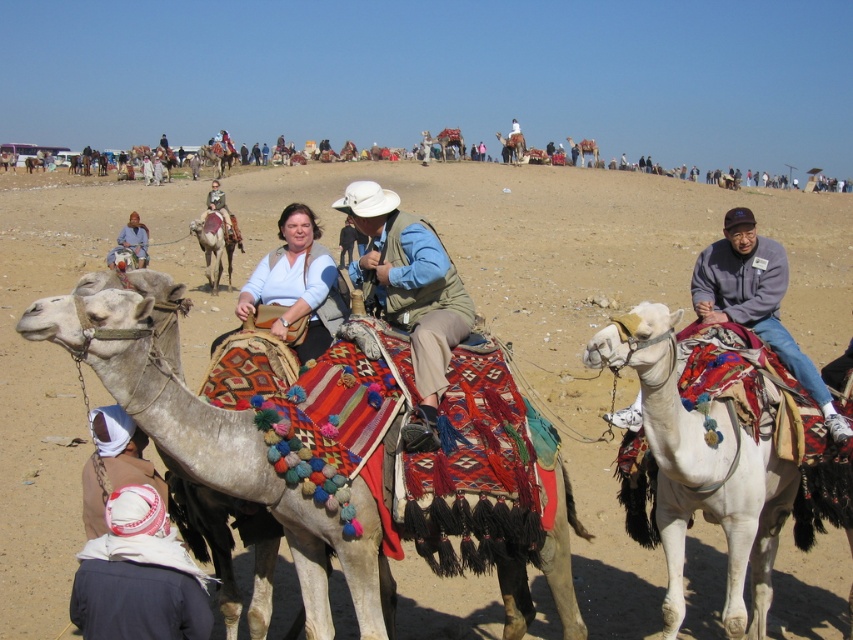
Between point (553, 582) and point (227, 225), which one is positioned in front?

Positioned in front is point (553, 582).

What do you see at coordinates (212, 440) in the screenshot? This screenshot has width=853, height=640. I see `white textured camel at center` at bounding box center [212, 440].

Is point (178, 307) closer to viewer compared to point (236, 228)?

Yes, it is.

Image resolution: width=853 pixels, height=640 pixels. I want to click on white textured camel at center, so click(212, 440).

Is light brown fabric vest at center smaller than matte blue shirt at center?

Yes, light brown fabric vest at center is smaller than matte blue shirt at center.

Does light brown fabric vest at center have a larger size compared to matte blue shirt at center?

Actually, light brown fabric vest at center might be smaller than matte blue shirt at center.

Measure the distance between light brown fabric vest at center and camera.

They are 12.79 feet apart.

I want to click on light brown fabric vest at center, so click(x=410, y=294).

Does light brown fabric vest at center come in front of light brown leather jacket at center?

Yes.

Is light brown fabric vest at center above light brown leather jacket at center?

Incorrect, light brown fabric vest at center is not positioned above light brown leather jacket at center.

Between point (363, 184) and point (231, 236), which one is positioned in front?

Point (363, 184) is in front.

Identify the location of light brown fabric vest at center. (410, 294).